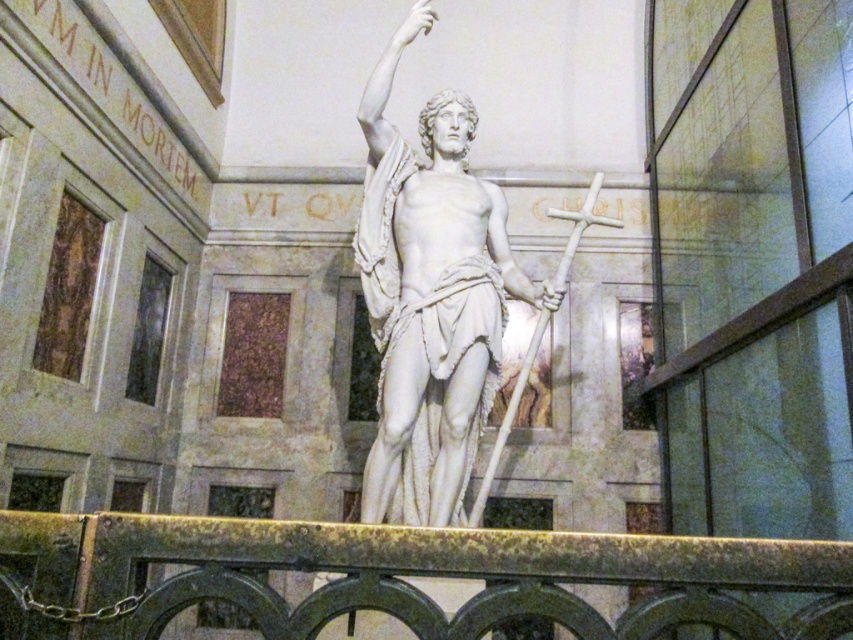
You are standing in front of the statue and want to take a photo of the point at coordinate point (660, 605). If your camera is 1.27 meters away from the point, will you be able to capture the entire statue in the frame?

The point at coordinate point (660, 605) is 1.27 meters away from the camera, so yes, you can capture the entire statue in the frame as the distance is sufficient.

You are standing in the museum and want to take a photo of the statue. There are two points marked on the floor where you can stand to get the best angles. The first point is at coordinates point (65, 618) and the second is at point (497, 205). Which point is closer to the statue?

Point (65, 618) is in front of point (497, 205), so it is closer to the statue.

You are an art conservator tasked with measuring the width of the objects in the scene. Which object has a greater width between the rusty metal railing at lower center and the white marble statue at center?

The rusty metal railing at lower center has a greater width than the white marble statue at center according to the description.